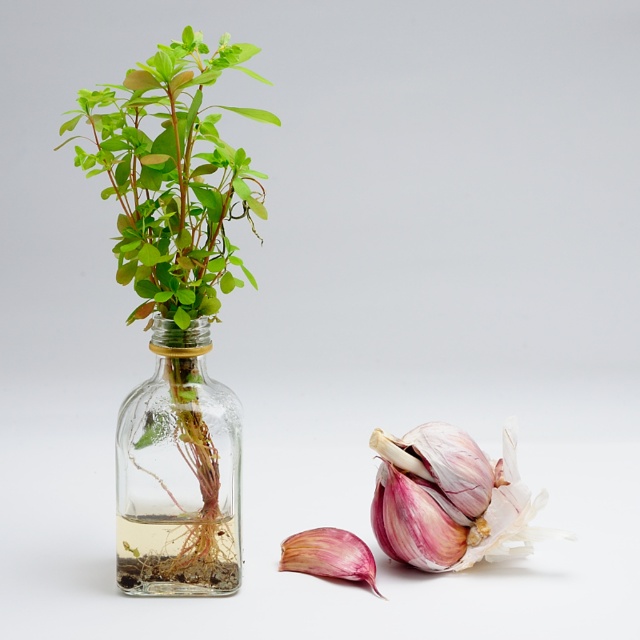
Please look at the image. There is a point at coordinates (179, 474). What object is located at that point?

The point at coordinates (179, 474) indicates the transparent glass vase at left.

You are designing a shelf display and want to place the green matte plant at center and the transparent glass vase at left next to each other. Based on their sizes, which one should you place first to ensure they fit properly?

The green matte plant at center has a larger width than the transparent glass vase at left, so you should place the green matte plant at center first to accommodate its wider size before positioning the transparent glass vase at left.